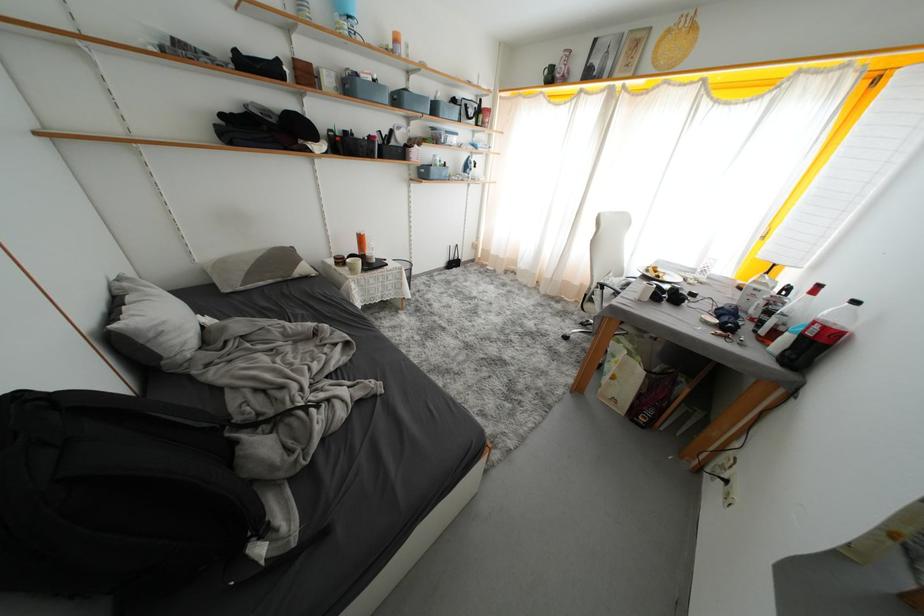
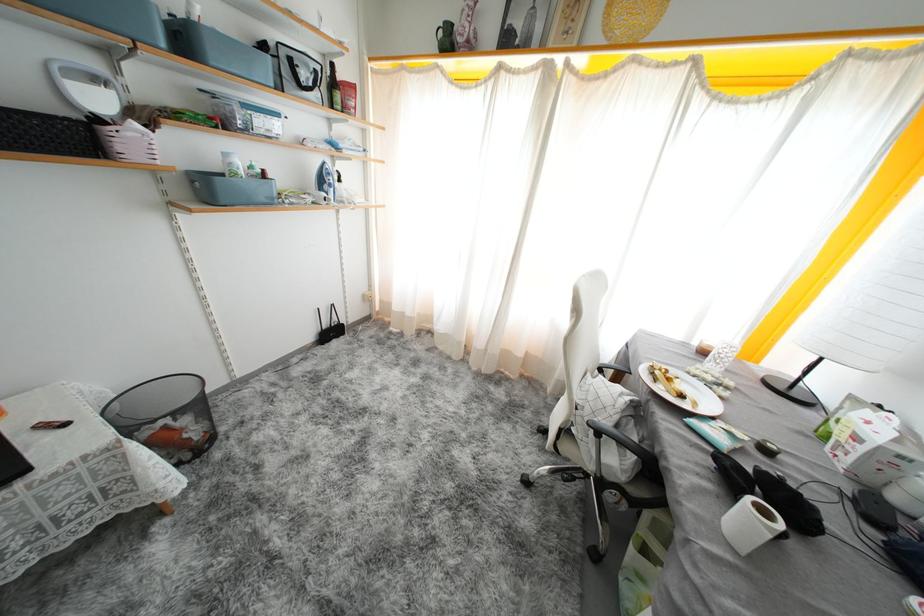
The point at [699,300] is marked in the first image. Where is the corresponding point in the second image?

(773, 455)